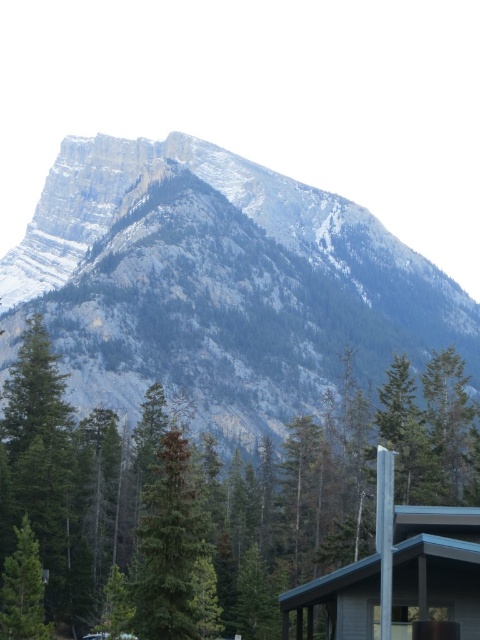
You are planning to install a wireless sensor between the wooden cabin at lower right and the green matte tree at lower left. The sensor requires a minimum distance of 50 meters between the two points to function properly. Based on the scene, will the sensor work effectively?

The wooden cabin at lower right is 56.50 meters from the green matte tree at lower left. Since the required minimum distance is 50 meters, the sensor will work effectively as the distance exceeds the requirement.

You are standing at the base of the rocky gray mountain at upper center and want to take a photo of it with your camera. The camera has a maximum zoom range of 100 meters. Can you capture the entire mountain in one shot without moving closer?

The rocky gray mountain at upper center is 329.86 meters away from camera. Since the camera only zooms up to 100 meters, you cannot capture the entire mountain in one shot without moving closer.